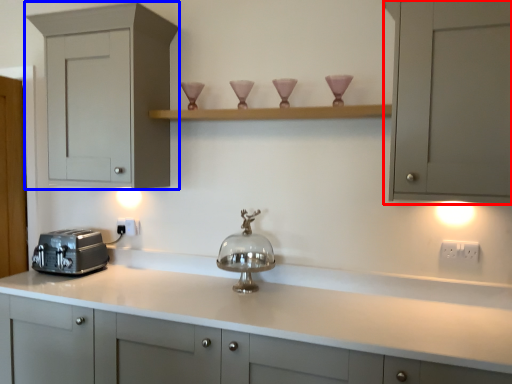
Question: Which of the following is the closest to the observer, cabinetry (highlighted by a red box) or cabinetry (highlighted by a blue box)?

Choices:
 (A) cabinetry
 (B) cabinetry

Answer: (A)